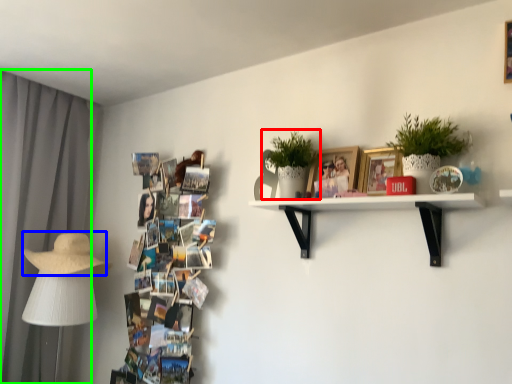
Question: Which object is positioned farthest from houseplant (highlighted by a red box)? Select from straw hat (highlighted by a blue box) and curtain (highlighted by a green box).

Choices:
 (A) straw hat
 (B) curtain

Answer: (B)